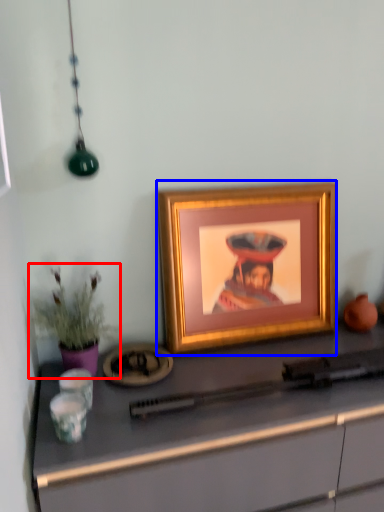
Question: Which object is closer to the camera taking this photo, houseplant (highlighted by a red box) or picture frame (highlighted by a blue box)?

Choices:
 (A) houseplant
 (B) picture frame

Answer: (A)